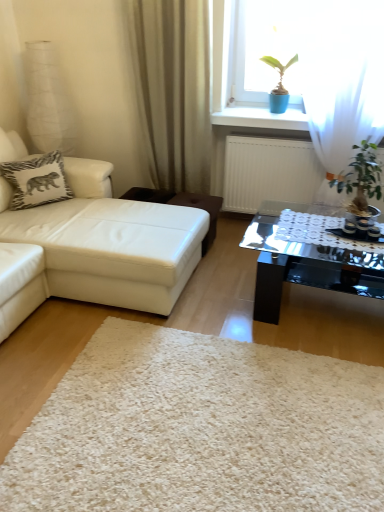
Question: In terms of size, does white shaggy rug at center appear bigger or smaller than white leather studio couch at left?

Choices:
 (A) small
 (B) big

Answer: (A)

Question: In the image, is white shaggy rug at center positioned in front of or behind white leather studio couch at left?

Choices:
 (A) behind
 (B) front

Answer: (B)

Question: Which of these objects is positioned closest to the white zebra-patterned pillow at upper left?

Choices:
 (A) transparent glass coffee table at center
 (B) white shaggy rug at center
 (C) beige fabric curtain at upper center
 (D) green leafy plant at right
 (E) brown leather stool at center

Answer: (E)

Question: Estimate the real-world distances between objects in this image. Which object is closer to the beige fabric curtain at upper center?

Choices:
 (A) green leafy plant at right
 (B) white leather studio couch at left
 (C) white zebra-patterned pillow at upper left
 (D) transparent glass coffee table at center
 (E) white shaggy rug at center

Answer: (B)